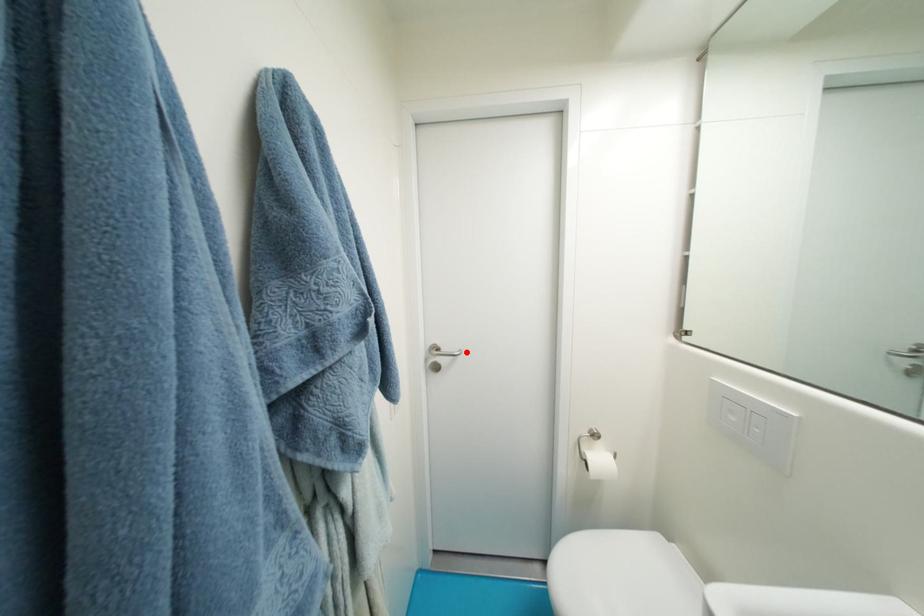
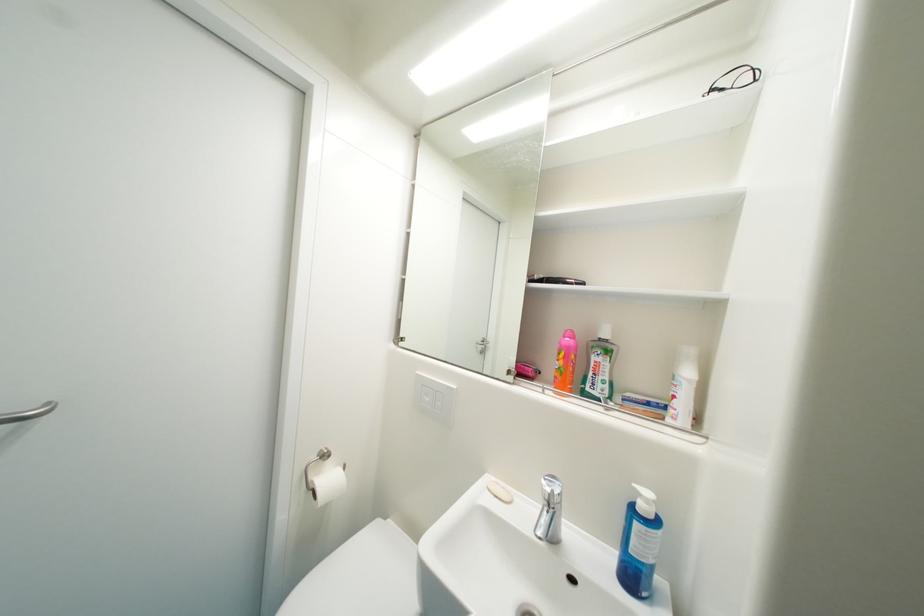
Find the pixel in the second image that matches the highlighted location in the first image.

(55, 405)